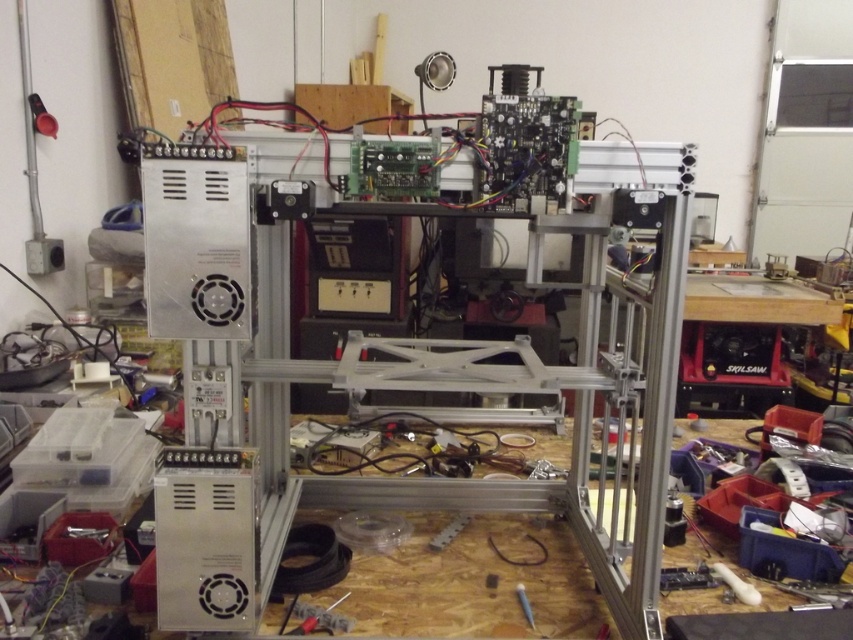
Question: Does white plastic tool at lower right have a larger size compared to metallic silver screwdriver at center?

Choices:
 (A) yes
 (B) no

Answer: (A)

Question: Can you confirm if white plastic tool at lower right is smaller than metallic silver screwdriver at center?

Choices:
 (A) no
 (B) yes

Answer: (A)

Question: Does white plastic tool at lower right have a greater width compared to metallic silver screwdriver at center?

Choices:
 (A) no
 (B) yes

Answer: (B)

Question: Which point is farther from the camera taking this photo?

Choices:
 (A) (524, 609)
 (B) (735, 584)

Answer: (B)